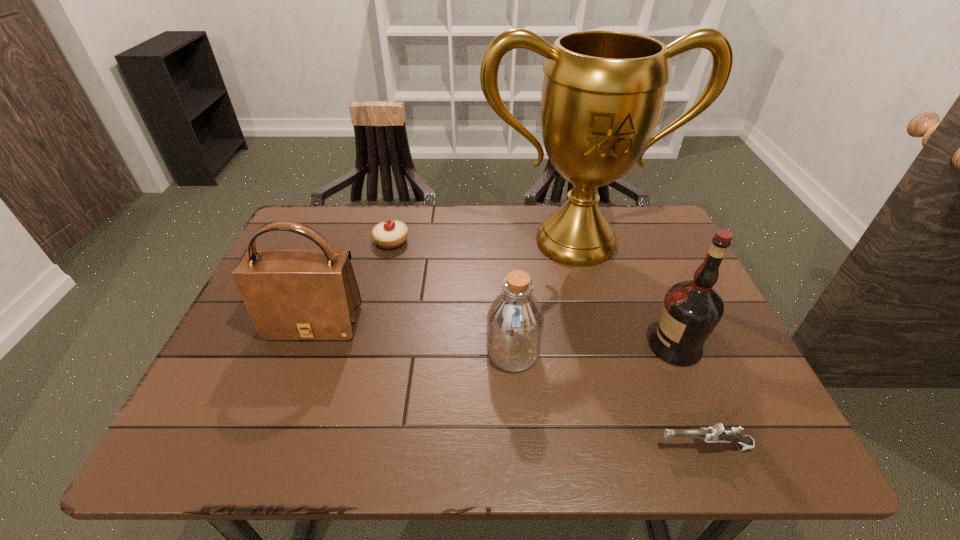
You are a GUI agent. You are given a task and a screenshot of the screen. Output one action in this format:
    pyautogui.click(x=<x>, y=<y>)
    Task: Click on the vacant area situated on the front flap of the shoulder bag
    The image size is (960, 540).
    Given the screenshot: What is the action you would take?
    pyautogui.click(x=285, y=401)

You are a GUI agent. You are given a task and a screenshot of the screen. Output one action in this format:
    pyautogui.click(x=<x>, y=<y>)
    Task: Click on the free region located 0.080m on the front of the bottle
    The width and height of the screenshot is (960, 540).
    Given the screenshot: What is the action you would take?
    pyautogui.click(x=516, y=408)

You are a GUI agent. You are given a task and a screenshot of the screen. Output one action in this format:
    pyautogui.click(x=<x>, y=<y>)
    Task: Click on the vacant space located 0.180m on the front of the pastry
    Image resolution: width=960 pixels, height=540 pixels.
    Given the screenshot: What is the action you would take?
    pyautogui.click(x=378, y=297)

The image size is (960, 540). I want to click on free space located aimed along the barrel of the gun, so click(x=627, y=446).

Locate an element on the screen. The height and width of the screenshot is (540, 960). vacant space located 0.160m aimed along the barrel of the gun is located at coordinates (573, 446).

Image resolution: width=960 pixels, height=540 pixels. In order to click on vacant area located 0.230m aimed along the barrel of the gun in this screenshot , I will do `click(536, 446)`.

Image resolution: width=960 pixels, height=540 pixels. What are the coordinates of `trophy cup that is at the far edge` in the screenshot? It's located at (602, 94).

At what (x,y) coordinates should I click in order to perform the action: click on pastry located in the far edge section of the desktop. Please return your answer as a coordinate pair (x, y). Looking at the image, I should click on (390, 234).

Identify the location of object that is at the near edge. The image size is (960, 540). (717, 433).

You are a GUI agent. You are given a task and a screenshot of the screen. Output one action in this format:
    pyautogui.click(x=<x>, y=<y>)
    Task: Click on the object that is at the left edge
    
    Given the screenshot: What is the action you would take?
    pyautogui.click(x=290, y=294)